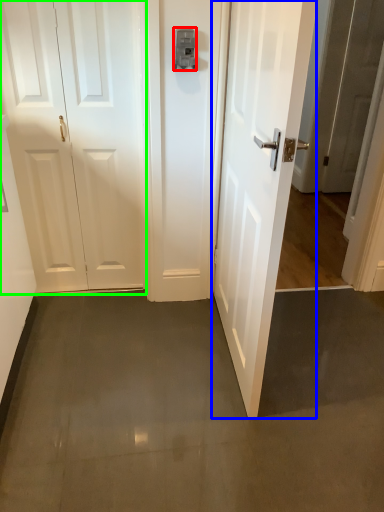
Question: Based on their relative distances, which object is nearer to latch (highlighted by a red box)? Choose from door (highlighted by a blue box) and door (highlighted by a green box).

Choices:
 (A) door
 (B) door

Answer: (B)